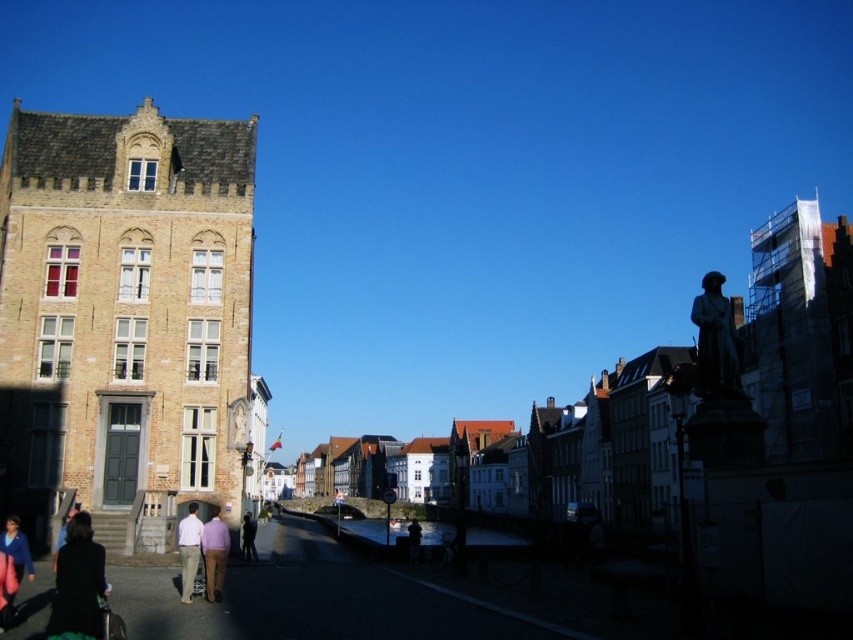
You are a tourist in this European town and want to take a photo of both the bronze statue at right and the blue fabric jacket at lower left. Which object should you position closer to the left side of your camera frame to include both in the photo?

You should position the blue fabric jacket at lower left closer to the left side of your camera frame because the bronze statue at right is to the right of the blue fabric jacket at lower left.

You are a tourist visiting this European town and spot the dark brown leather jacket at lower left and the bronze statue at right. Which object is closer to the ground?

The dark brown leather jacket at lower left is positioned under the bronze statue at right, meaning it is closer to the ground.